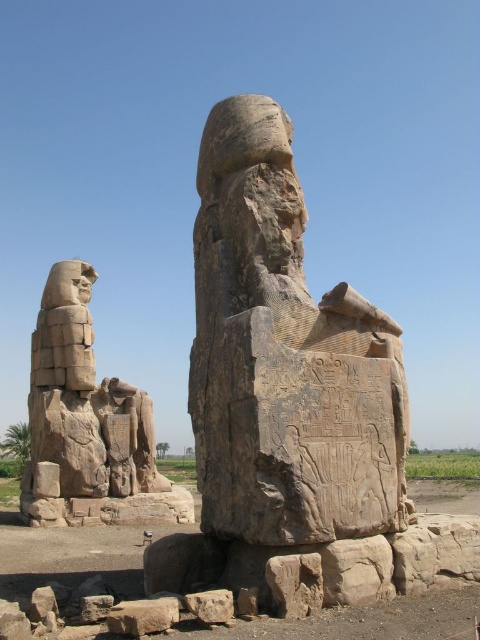
Is point (191, 604) behind point (103, 604)?

No.

Is brown rough stone at center wider than rusty stone block at lower left?

Yes, brown rough stone at center is wider than rusty stone block at lower left.

Is point (232, 616) more distant than point (108, 605)?

No, (232, 616) is in front of (108, 605).

Image resolution: width=480 pixels, height=640 pixels. I want to click on brown rough stone at center, so click(211, 605).

Is granite statue at center positioned before gray stone at lower center?

No.

Does granite statue at center have a lesser height compared to gray stone at lower center?

In fact, granite statue at center may be taller than gray stone at lower center.

This screenshot has width=480, height=640. Describe the element at coordinates (285, 356) in the screenshot. I see `granite statue at center` at that location.

Image resolution: width=480 pixels, height=640 pixels. I want to click on granite statue at center, so click(x=285, y=356).

Can you confirm if granite statue at center is thinner than rusty stone block at lower left?

Incorrect, granite statue at center's width is not less than rusty stone block at lower left's.

Who is positioned more to the right, granite statue at center or rusty stone block at lower left?

Positioned to the right is granite statue at center.

Describe the element at coordinates (285, 356) in the screenshot. I see `granite statue at center` at that location.

The width and height of the screenshot is (480, 640). Identify the location of granite statue at center. (285, 356).